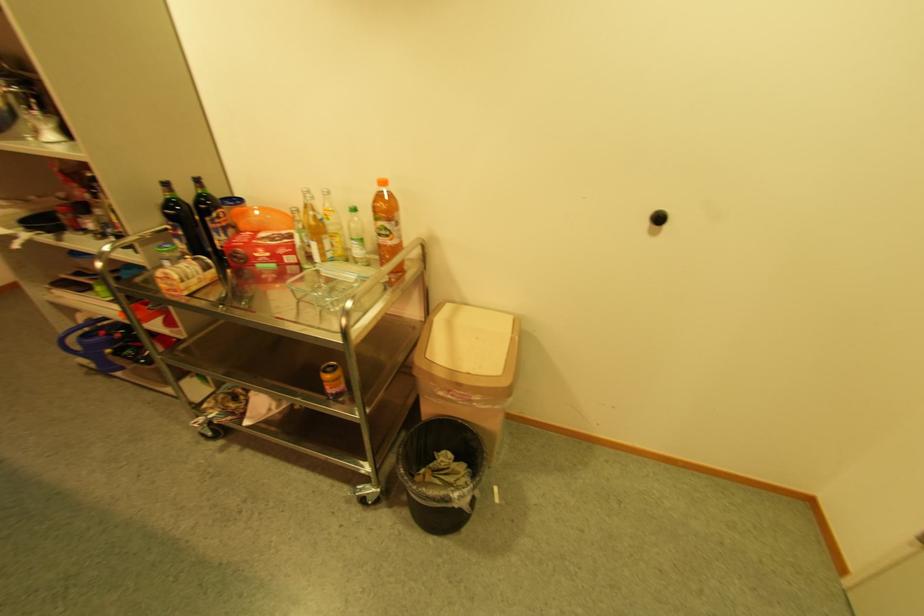
Identify the location of orange plastic bottle. The width and height of the screenshot is (924, 616). click(386, 227).